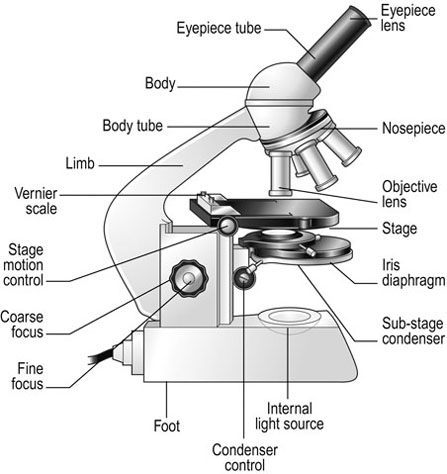
Locate an element on the screen. internal light source is located at coordinates (288, 323).